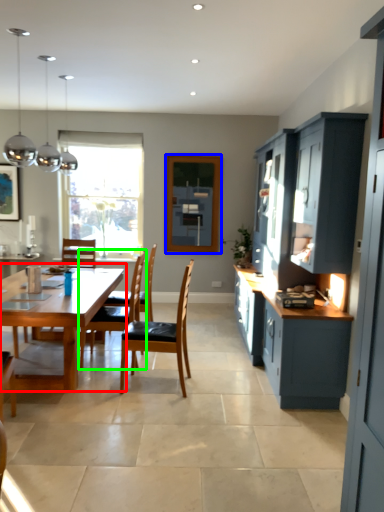
Question: Which is nearer to the kitchen & dining room table (highlighted by a red box)? window screen (highlighted by a blue box) or chair (highlighted by a green box).

Choices:
 (A) window screen
 (B) chair

Answer: (B)